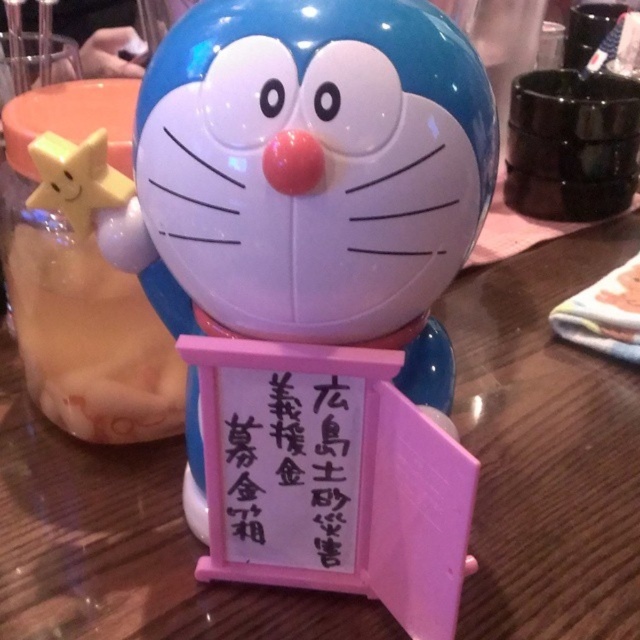
Looking at this image, does glossy plastic doraemon at center appear under pink paper sign at center?

Actually, glossy plastic doraemon at center is above pink paper sign at center.

Between glossy plastic doraemon at center and pink paper sign at center, which one appears on the right side from the viewer's perspective?

glossy plastic doraemon at center is more to the right.

Is point (385, 273) in front of point (289, 380)?

Yes, it is.

You are a GUI agent. You are given a task and a screenshot of the screen. Output one action in this format:
    pyautogui.click(x=<x>, y=<y>)
    Task: Click on the glossy plastic doraemon at center
    
    Given the screenshot: What is the action you would take?
    pyautogui.click(x=310, y=179)